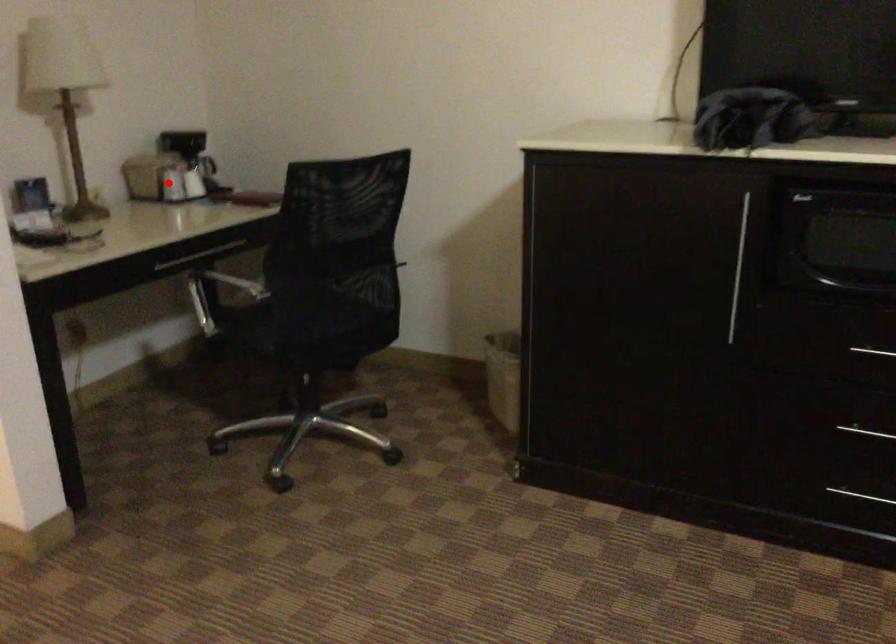
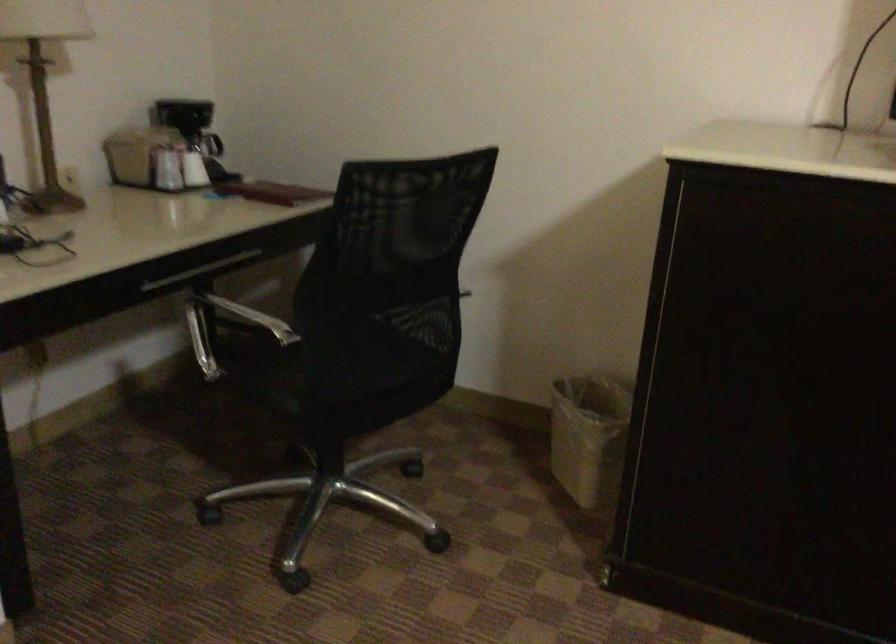
Question: I am providing you with two images of the same scene from different viewpoints. In image1, a red point is highlighted. Considering the same 3D point in image2, which of the following is correct?

Choices:
 (A) It is closer
 (B) It is farther

Answer: (A)